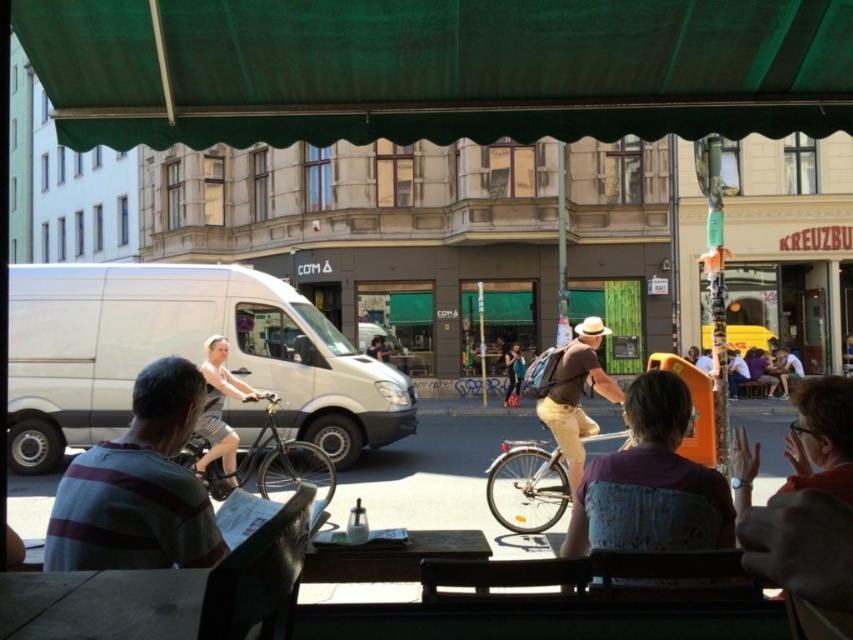
Consider the image. Can you confirm if wooden table at center is positioned below light gray striped dress at center?

Yes, wooden table at center is below light gray striped dress at center.

This screenshot has width=853, height=640. Identify the location of wooden table at center. point(390,556).

What do you see at coordinates (390, 556) in the screenshot? I see `wooden table at center` at bounding box center [390, 556].

This screenshot has height=640, width=853. I want to click on wooden table at center, so click(390, 556).

Does green fabric canopy at upper center have a smaller size compared to matte black bicycle at center?

Actually, green fabric canopy at upper center might be larger than matte black bicycle at center.

Which is behind, point (148, 109) or point (370, 342)?

Point (370, 342)

Locate an element on the screen. This screenshot has width=853, height=640. green fabric canopy at upper center is located at coordinates (434, 68).

Does brown cotton shirt at center have a larger size compared to blue denim jeans at center?

Yes, brown cotton shirt at center is bigger than blue denim jeans at center.

Is point (564, 412) positioned in front of point (511, 358)?

Yes, point (564, 412) is closer to viewer.

Locate an element on the screen. The width and height of the screenshot is (853, 640). brown cotton shirt at center is located at coordinates (576, 394).